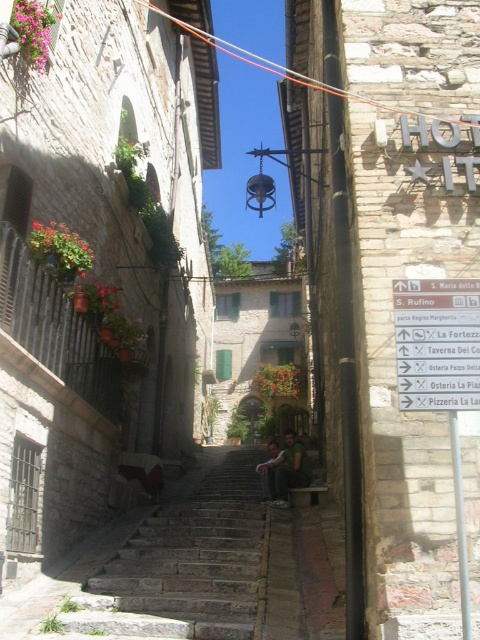
You are standing in the middle of the alleyway and see the stone stairs at center and the green fabric shirt at center. Which object is positioned to the left of the other?

The stone stairs at center is to the left of green fabric shirt at center.